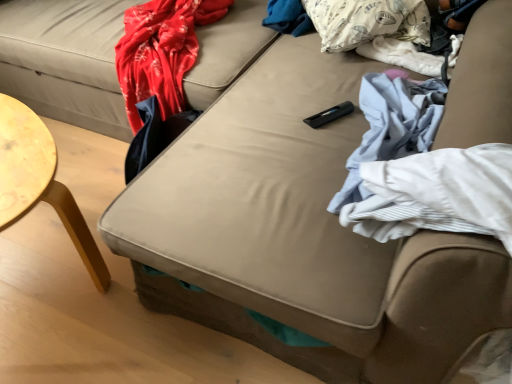
Question: From the image's perspective, relative to white fabric at right, is white printed pillow at upper right above or below?

Choices:
 (A) above
 (B) below

Answer: (A)

Question: Considering the relative positions of white printed pillow at upper right and white fabric at right in the image provided, is white printed pillow at upper right to the left or to the right of white fabric at right?

Choices:
 (A) left
 (B) right

Answer: (A)

Question: Based on their sizes in the image, would you say white printed pillow at upper right is bigger or smaller than white fabric at right?

Choices:
 (A) small
 (B) big

Answer: (B)

Question: In terms of height, does white fabric at right look taller or shorter compared to white printed pillow at upper right?

Choices:
 (A) tall
 (B) short

Answer: (B)

Question: Choose the correct answer: Is white fabric at right inside white printed pillow at upper right or outside it?

Choices:
 (A) outside
 (B) inside

Answer: (A)

Question: Would you say white fabric at right is to the left or to the right of white printed pillow at upper right in the picture?

Choices:
 (A) right
 (B) left

Answer: (A)

Question: From a real-world perspective, is white fabric at right above or below white printed pillow at upper right?

Choices:
 (A) above
 (B) below

Answer: (B)